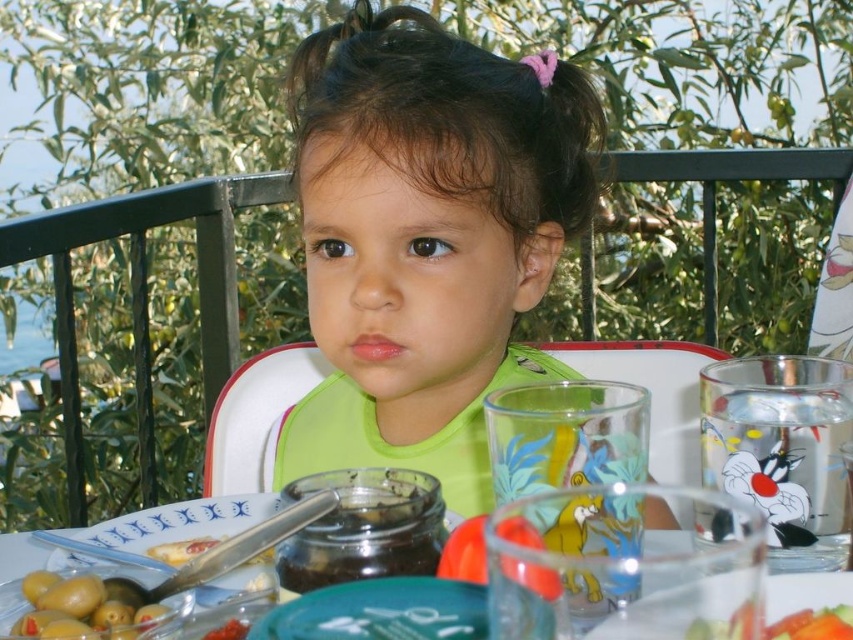
Does smooth plastic cup at lower right have a lesser width compared to yellow creamy spread at lower left?

Yes, smooth plastic cup at lower right is thinner than yellow creamy spread at lower left.

Between smooth plastic cup at lower right and yellow creamy spread at lower left, which one appears on the right side from the viewer's perspective?

smooth plastic cup at lower right is more to the right.

Locate an element on the screen. This screenshot has height=640, width=853. smooth plastic cup at lower right is located at coordinates (813, 625).

Can you confirm if green matte bib at center is shorter than smooth plastic cup at lower right?

No.

Can you confirm if green matte bib at center is bigger than smooth plastic cup at lower right?

Indeed, green matte bib at center has a larger size compared to smooth plastic cup at lower right.

Describe the element at coordinates (426, 237) in the screenshot. This screenshot has width=853, height=640. I see `green matte bib at center` at that location.

Image resolution: width=853 pixels, height=640 pixels. Find the location of `green matte bib at center`. green matte bib at center is located at coordinates (426, 237).

Is point (9, 561) positioned in front of point (167, 557)?

No, it is behind (167, 557).

Image resolution: width=853 pixels, height=640 pixels. What do you see at coordinates (181, 518) in the screenshot?
I see `translucent glass jar at center` at bounding box center [181, 518].

The width and height of the screenshot is (853, 640). In order to click on translucent glass jar at center in this screenshot , I will do `click(181, 518)`.